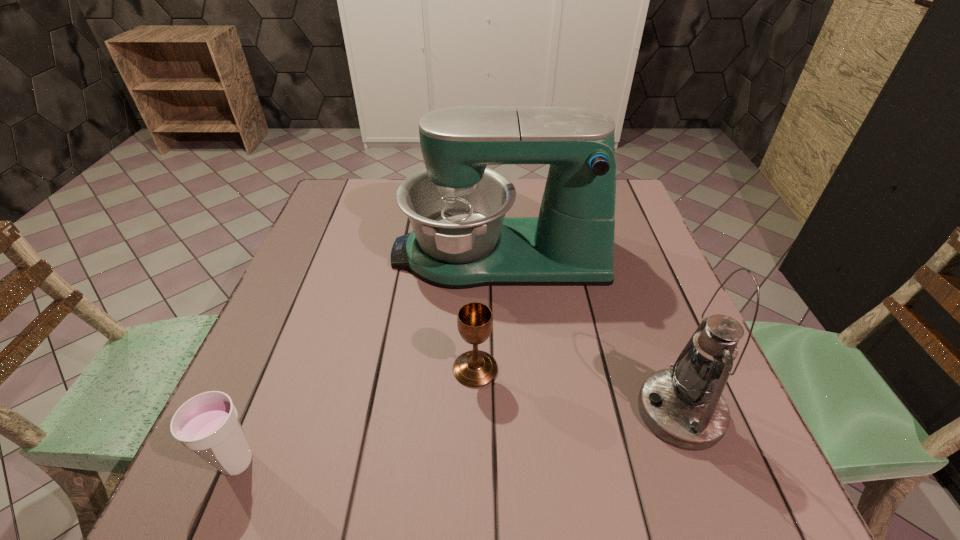
Locate which object ranks second in proximity to the oil lamp. Please provide its 2D coordinates. Your answer should be formatted as a tuple, i.e. [(x, y)], where the tuple contains the x and y coordinates of a point satisfying the conditions above.

[(475, 368)]

Locate which object ranks second in proximity to the cup. Please provide its 2D coordinates. Your answer should be formatted as a tuple, i.e. [(x, y)], where the tuple contains the x and y coordinates of a point satisfying the conditions above.

[(461, 238)]

The height and width of the screenshot is (540, 960). I want to click on vacant space that satisfies the following two spatial constraints: 1. on the front-facing side of the mixer; 2. on the front side of the cup, so click(x=510, y=462).

You are a GUI agent. You are given a task and a screenshot of the screen. Output one action in this format:
    pyautogui.click(x=<x>, y=<y>)
    Task: Click on the free space that satisfies the following two spatial constraints: 1. on the front-facing side of the farthest object; 2. on the front side of the chalice
    
    Given the screenshot: What is the action you would take?
    coord(505,369)

Where is `free space in the image that satisfies the following two spatial constraints: 1. on the front-facing side of the farthest object; 2. on the left side of the oil lamp`? free space in the image that satisfies the following two spatial constraints: 1. on the front-facing side of the farthest object; 2. on the left side of the oil lamp is located at coordinates (507, 411).